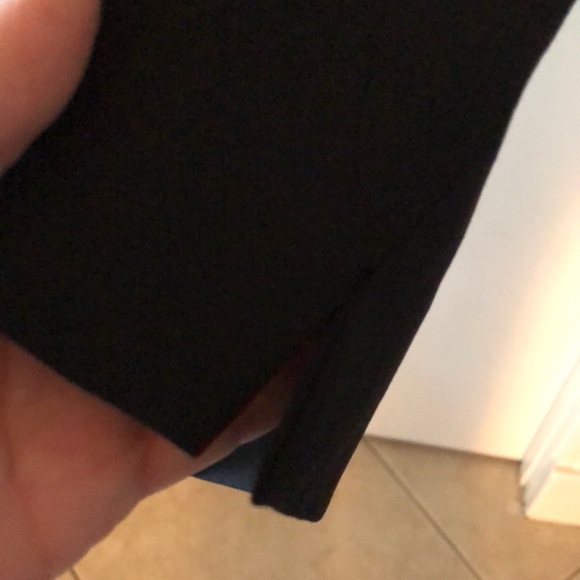
In order to click on door in this screenshot , I will do `click(474, 398)`, `click(493, 311)`.